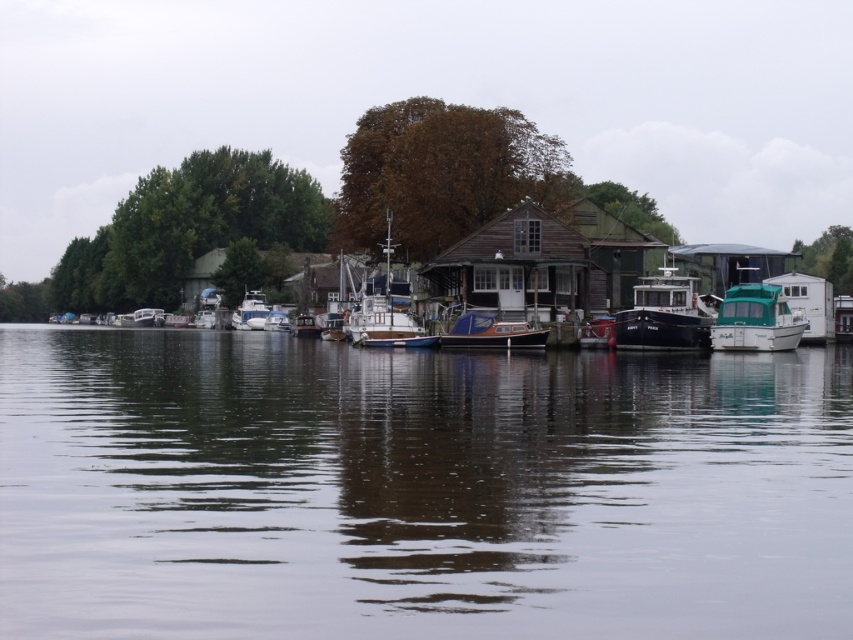
Question: Based on their relative distances, which object is farther from the white matte boat at left?

Choices:
 (A) white glossy boat at center
 (B) blue glossy boat at center

Answer: (B)

Question: Is white wooden boat at center above white glossy boat at center?

Choices:
 (A) yes
 (B) no

Answer: (A)

Question: Does transparent water at center have a smaller size compared to white glossy boat at center?

Choices:
 (A) no
 (B) yes

Answer: (A)

Question: Can you confirm if matte black boat at center is wider than teal glossy houseboat at right?

Choices:
 (A) yes
 (B) no

Answer: (A)

Question: Which is farther from the blue glossy boat at center?

Choices:
 (A) transparent water at center
 (B) white matte boat at left
 (C) matte black boat at center
 (D) white wooden boat at center

Answer: (B)

Question: Which point is farther to the camera?

Choices:
 (A) transparent water at center
 (B) blue glossy boat at center
 (C) white matte boat at left
 (D) teal glossy houseboat at right

Answer: (C)